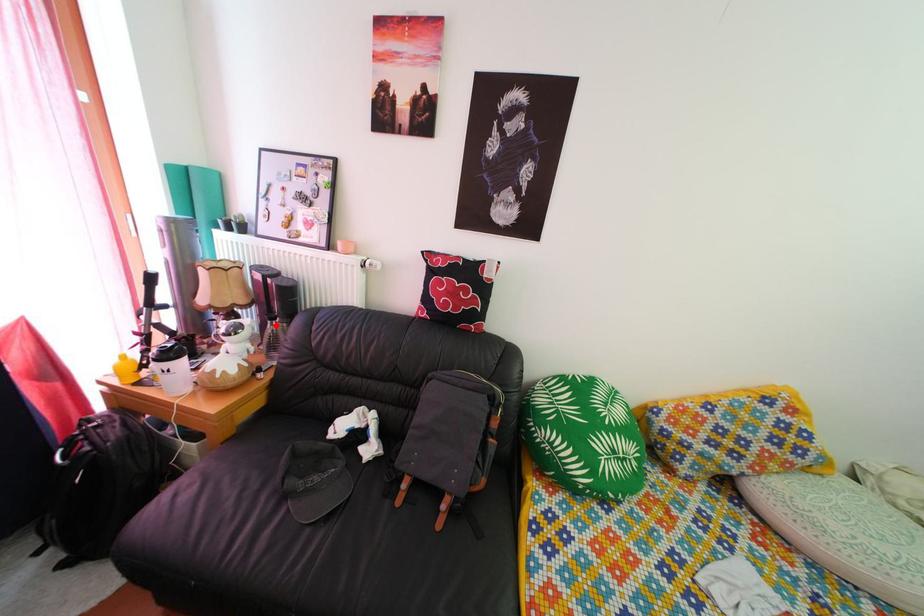
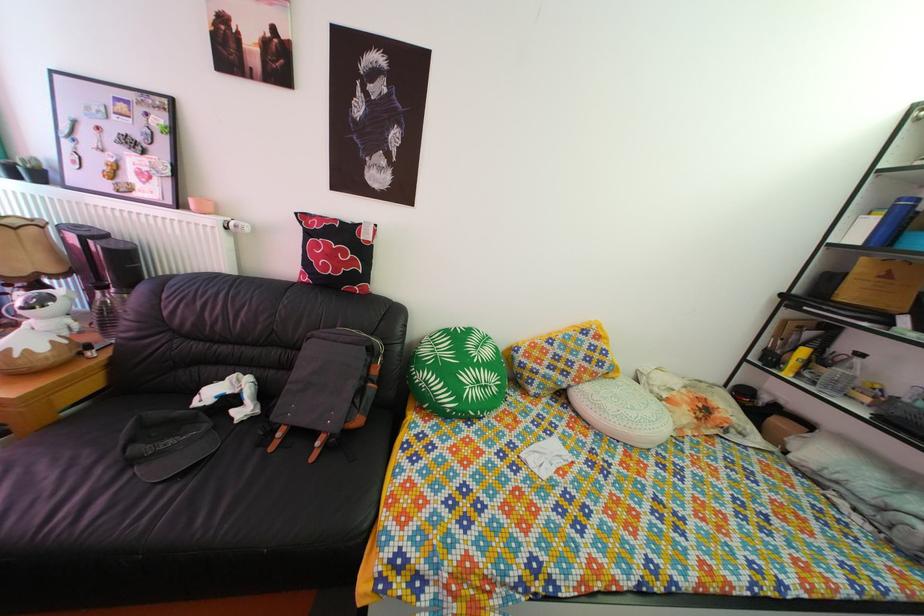
Question: I am providing you with two images of the same scene from different viewpoints. A red point is marked on the first image. Is the red point's position out of view in image 2?

Choices:
 (A) Yes
 (B) No

Answer: (B)